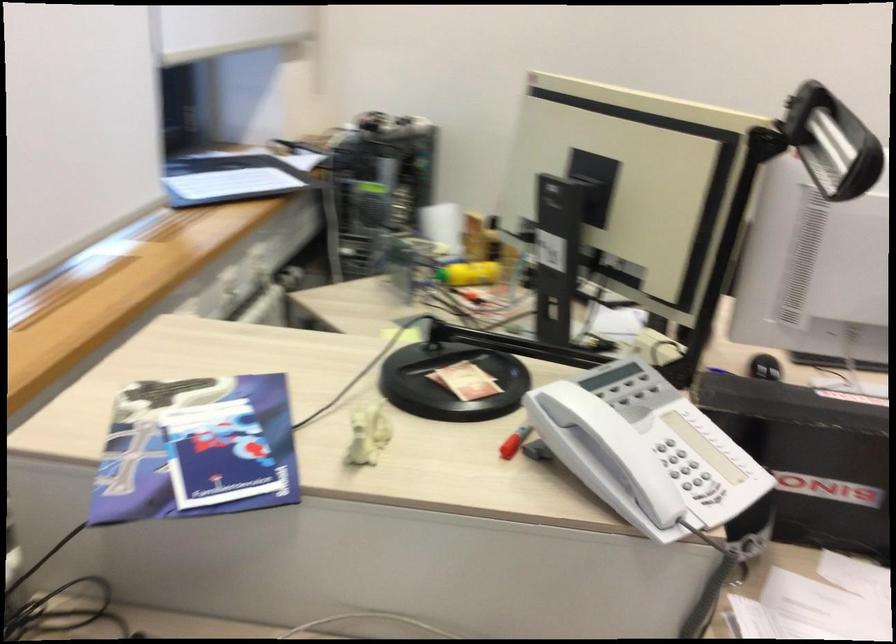
At what (x,y) coordinates should I click in order to perform the action: click on white phone handset. Please return your answer as a coordinate pair (x, y). This screenshot has height=644, width=896. Looking at the image, I should click on (613, 446).